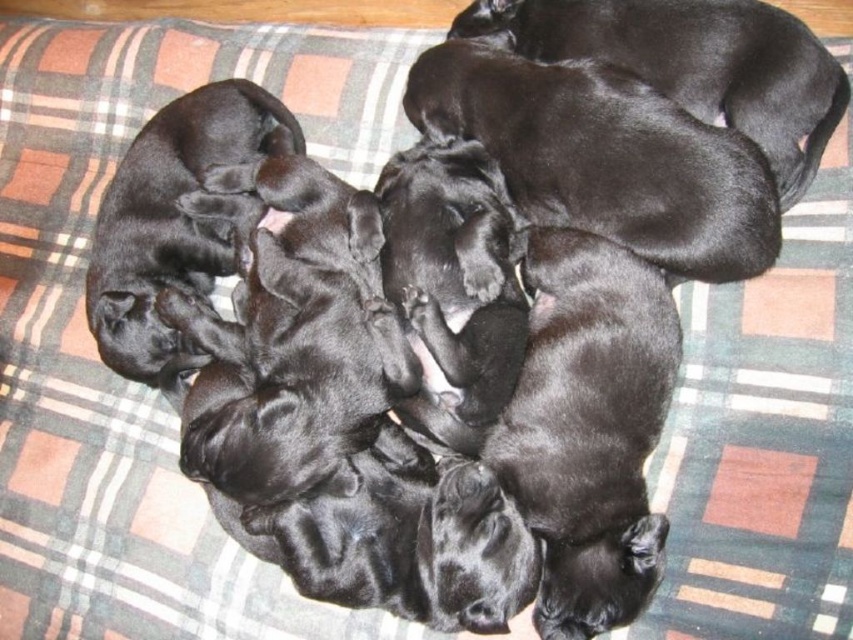
Question: Observing the image, what is the correct spatial positioning of black smooth fur puppies at center in reference to shiny black puppies at upper right?

Choices:
 (A) below
 (B) above

Answer: (A)

Question: Is black smooth fur puppies at center below black smooth puppies at left?

Choices:
 (A) yes
 (B) no

Answer: (A)

Question: Which of the following is the farthest from the observer?

Choices:
 (A) shiny black puppies at upper right
 (B) black smooth fur puppies at center
 (C) black smooth puppies at left

Answer: (C)

Question: Is black smooth fur puppies at center behind black smooth puppies at left?

Choices:
 (A) no
 (B) yes

Answer: (A)

Question: Which point is closer to the camera taking this photo?

Choices:
 (A) (120, 260)
 (B) (548, 556)
 (C) (712, 36)

Answer: (B)

Question: Which object is farther from the camera taking this photo?

Choices:
 (A) black smooth puppies at left
 (B) black smooth fur puppies at center

Answer: (A)